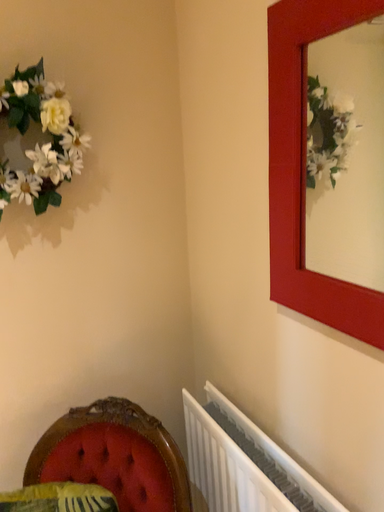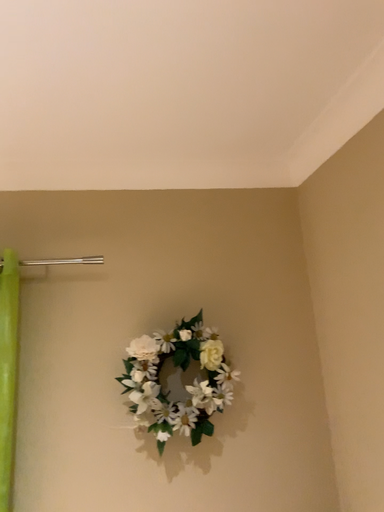
Question: How did the camera likely rotate when shooting the video?

Choices:
 (A) rotated right
 (B) rotated left

Answer: (B)